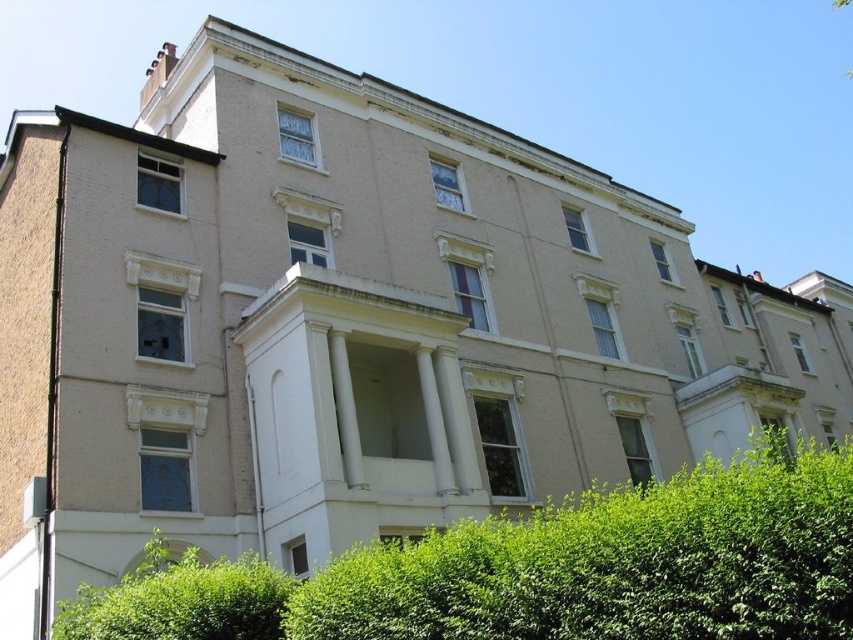
Question: Is green leafy hedge at lower center positioned before green leafy hedge at lower left?

Choices:
 (A) no
 (B) yes

Answer: (B)

Question: Among these points, which one is nearest to the camera?

Choices:
 (A) pos(740,467)
 (B) pos(247,579)

Answer: (A)

Question: Observing the image, what is the correct spatial positioning of green leafy hedge at lower center in reference to green leafy hedge at lower left?

Choices:
 (A) above
 (B) below

Answer: (A)

Question: Observing the image, what is the correct spatial positioning of green leafy hedge at lower center in reference to green leafy hedge at lower left?

Choices:
 (A) above
 (B) below

Answer: (A)

Question: Which object is closer to the camera taking this photo?

Choices:
 (A) green leafy hedge at lower left
 (B) green leafy hedge at lower center

Answer: (B)